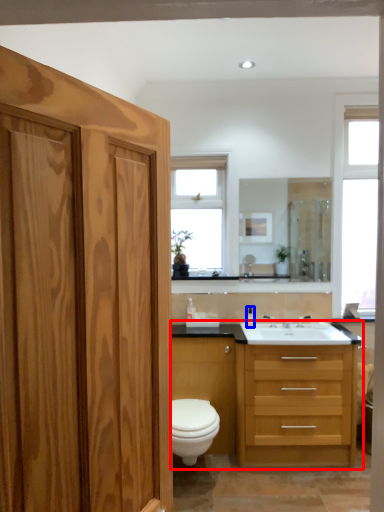
Question: Which object is further to the camera taking this photo, bathroom cabinet (highlighted by a red box) or toiletry (highlighted by a blue box)?

Choices:
 (A) bathroom cabinet
 (B) toiletry

Answer: (B)